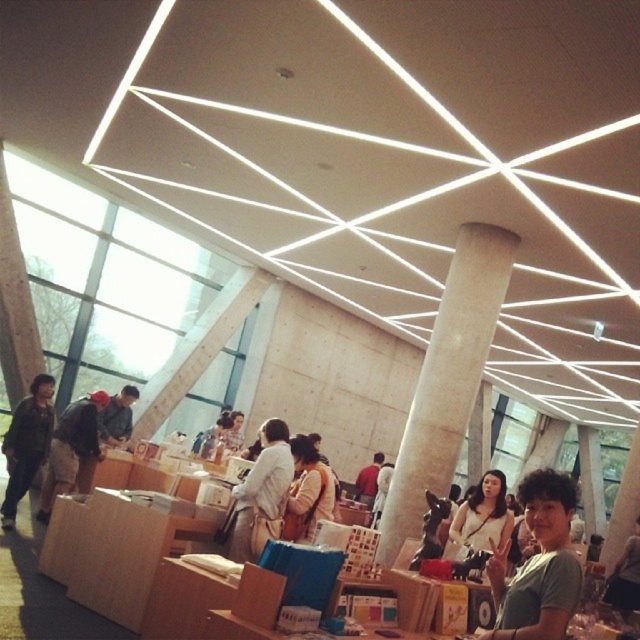
You are an interior designer working on a layout for this space. You need to place a matte white shirt at center. Where should you place it?

You should place the matte white shirt at center at point (481, 516).

Based on the photo, you are an assistant organizing a clothing display in the exhibition space. You have a white cotton shirt at center and a brown fuzzy jacket at left. Which piece of clothing is positioned higher up in the display?

The white cotton shirt at center is positioned higher up than the brown fuzzy jacket at left.

You are a delivery robot with a 1.5 meter long package that needs to be placed between the khaki pants at left and the matte white shirt at center. The package must be placed along the straight path connecting them. Is there enough space to place the package without moving either object?

The distance between the khaki pants at left and matte white shirt at center is 4.82 meters. Since the package is only 1.5 meters long, there is sufficient space to place it along the path between them without moving either object.